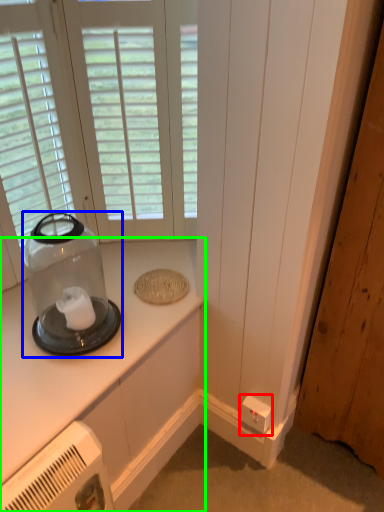
Question: Considering the real-world distances, which object is closest to electric outlet (highlighted by a red box)? appliance (highlighted by a blue box) or countertop (highlighted by a green box).

Choices:
 (A) appliance
 (B) countertop

Answer: (B)